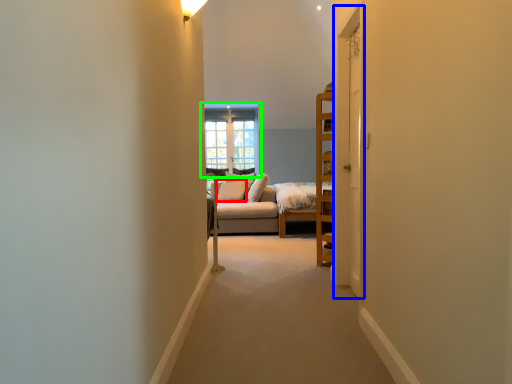
Question: Which object is positioned closest to pillow (highlighted by a red box)? Select from door (highlighted by a blue box) and window (highlighted by a green box).

Choices:
 (A) door
 (B) window

Answer: (B)